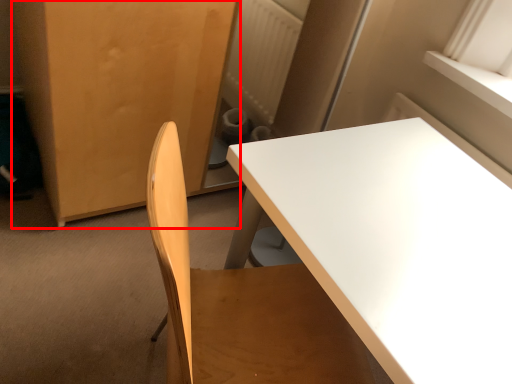
Question: From the image's perspective, what is the correct spatial relationship of armoire (annotated by the red box) in relation to table?

Choices:
 (A) above
 (B) below

Answer: (A)